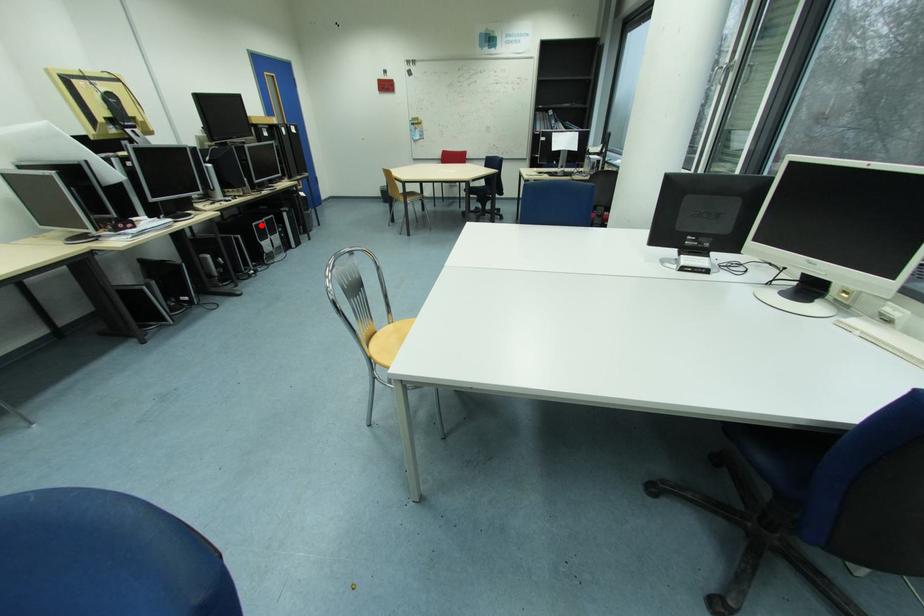
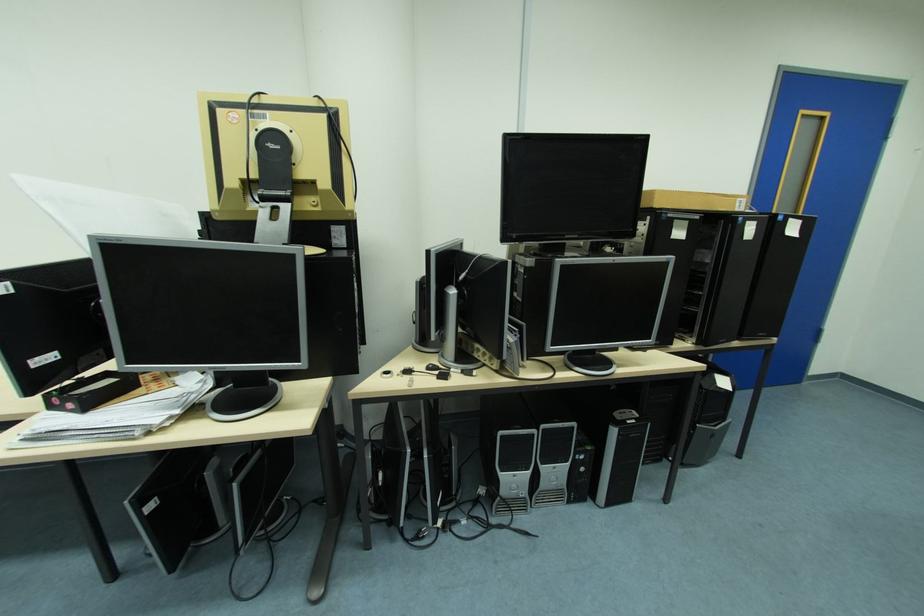
Question: I am providing you with two images of the same scene from different viewpoints. In image1, a red point is highlighted. Considering the same 3D point in image2, which of the following is correct?

Choices:
 (A) It is closer
 (B) It is farther

Answer: (B)